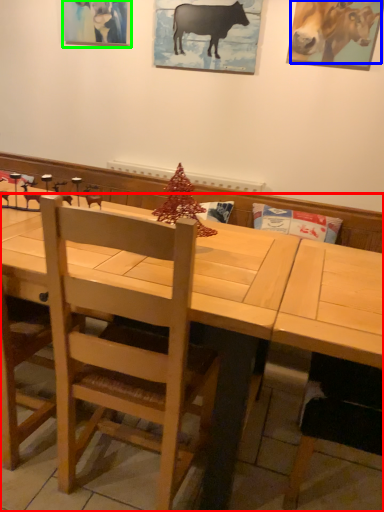
Question: Considering the real-world distances, which object is closest to table (highlighted by a red box)? cattle (highlighted by a blue box) or picture frame (highlighted by a green box).

Choices:
 (A) cattle
 (B) picture frame

Answer: (A)